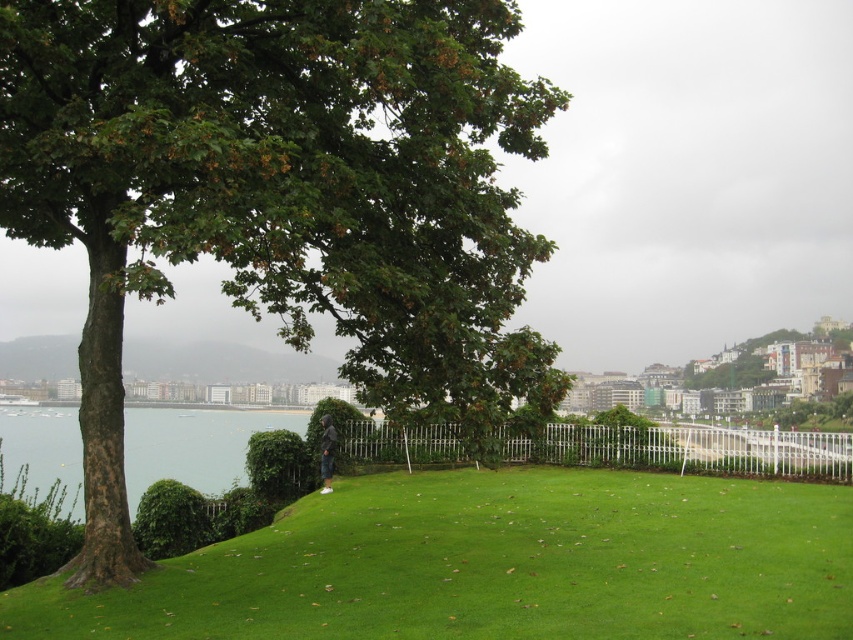
Between green leafy tree at left and white metal fence at center, which one is positioned lower?

Result: Positioned lower is white metal fence at center.

Does green leafy tree at left have a greater height compared to white metal fence at center?

Yes, green leafy tree at left is taller than white metal fence at center.

Describe the element at coordinates (277, 189) in the screenshot. I see `green leafy tree at left` at that location.

Where is `green leafy tree at left`? This screenshot has width=853, height=640. green leafy tree at left is located at coordinates (277, 189).